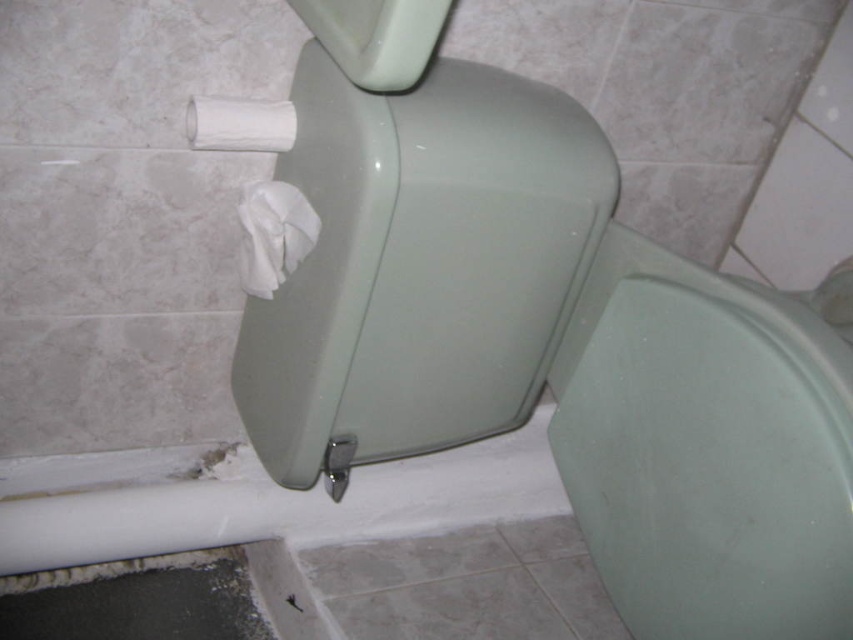
Question: Estimate the real-world distances between objects in this image. Which object is farther from the white matte toilet paper at upper left?

Choices:
 (A) matte green toilet bowl at center
 (B) white matte toilet paper at center

Answer: (A)

Question: Which object is positioned farthest from the white matte toilet paper at upper left?

Choices:
 (A) white matte toilet paper at center
 (B) matte green toilet bowl at center

Answer: (B)

Question: Is white matte toilet paper at center wider than white matte toilet paper at upper left?

Choices:
 (A) no
 (B) yes

Answer: (B)

Question: Observing the image, what is the correct spatial positioning of matte green toilet bowl at center in reference to white matte toilet paper at upper left?

Choices:
 (A) below
 (B) above

Answer: (A)

Question: Which object appears farthest from the camera in this image?

Choices:
 (A) matte green toilet bowl at center
 (B) white matte toilet paper at upper left

Answer: (B)

Question: Can you confirm if white matte toilet paper at center is bigger than white matte toilet paper at upper left?

Choices:
 (A) yes
 (B) no

Answer: (A)